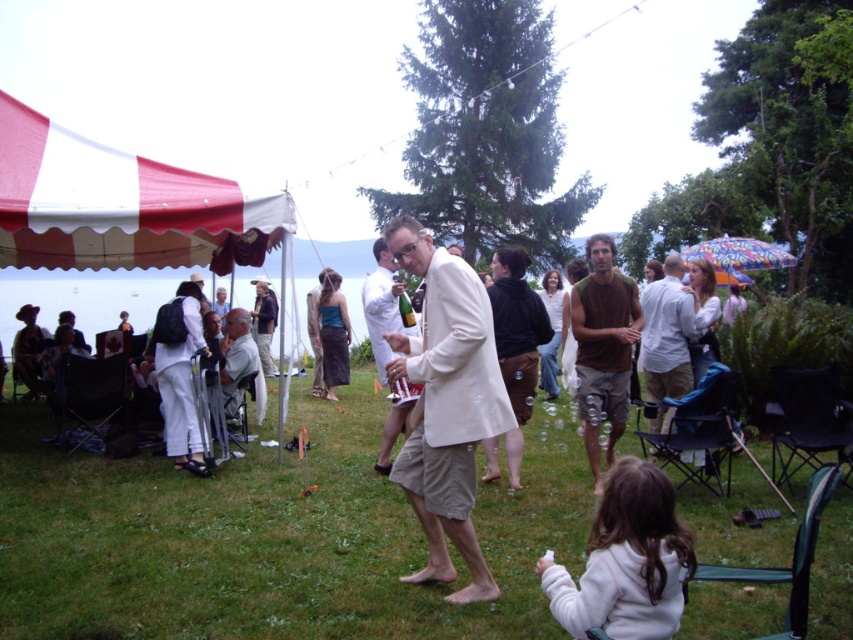
Question: Is light beige suit at center further to the viewer compared to light gray suit at center?

Choices:
 (A) no
 (B) yes

Answer: (A)

Question: Which point is farther from the camera taking this photo?

Choices:
 (A) (28, 115)
 (B) (234, 381)
 (C) (144, 172)

Answer: (B)

Question: Which of the following is the farthest from the observer?

Choices:
 (A) (238, 381)
 (B) (587, 384)

Answer: (A)

Question: Which of the following is the farthest from the observer?

Choices:
 (A) light beige suit at center
 (B) brown cotton t-shirt at center

Answer: (B)

Question: Is white fleece jacket at lower right smaller than light gray suit at center?

Choices:
 (A) no
 (B) yes

Answer: (B)

Question: Is light beige suit at center in front of light gray suit at center?

Choices:
 (A) no
 (B) yes

Answer: (B)